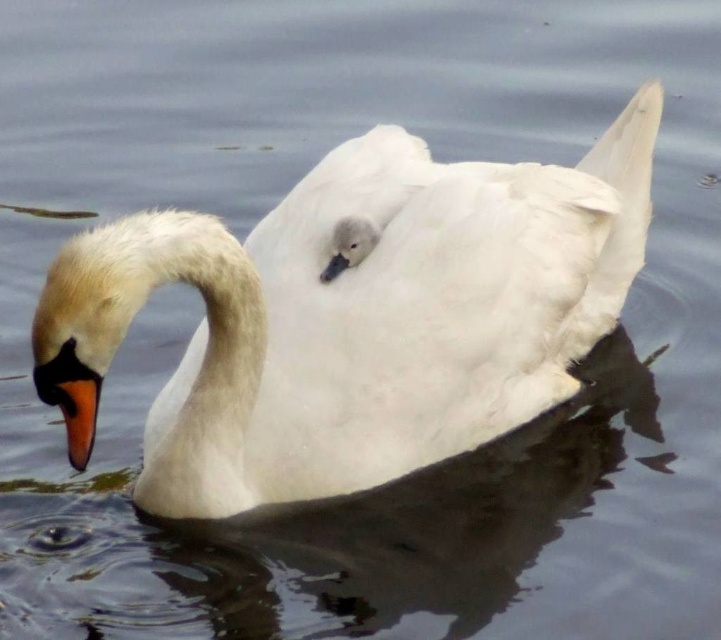
Question: Which object appears farthest from the camera in this image?

Choices:
 (A) orange matte beak at lower left
 (B) white matte swan at center

Answer: (A)

Question: Considering the relative positions of white matte swan at center and orange matte beak at lower left in the image provided, where is white matte swan at center located with respect to orange matte beak at lower left?

Choices:
 (A) below
 (B) above

Answer: (B)

Question: Does white matte swan at center have a smaller size compared to orange matte beak at lower left?

Choices:
 (A) yes
 (B) no

Answer: (B)

Question: Does white matte swan at center appear over orange matte beak at lower left?

Choices:
 (A) no
 (B) yes

Answer: (B)

Question: Which point appears closest to the camera in this image?

Choices:
 (A) (322, 192)
 (B) (87, 458)

Answer: (B)

Question: Which object is farther from the camera taking this photo?

Choices:
 (A) orange matte beak at lower left
 (B) white matte swan at center

Answer: (A)